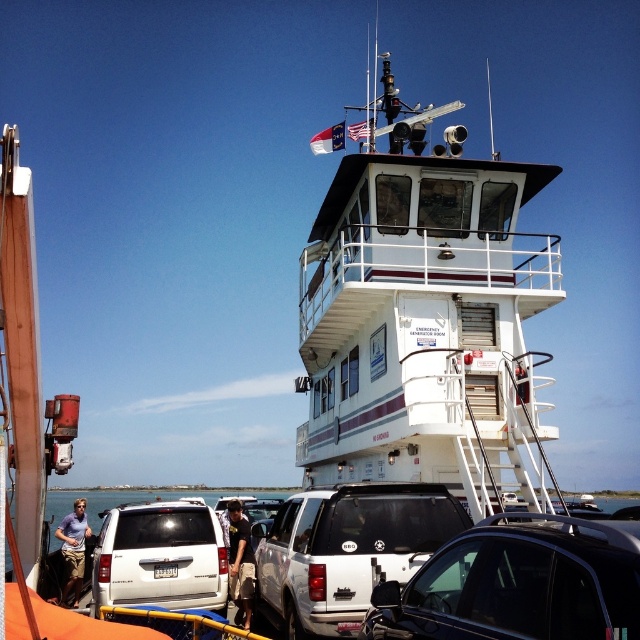
Question: Which object is positioned closest to the white matte suv at center?

Choices:
 (A) white glossy boat at upper center
 (B) white matte suv at lower left

Answer: (B)

Question: Can you confirm if white matte suv at center is thinner than matte blue shirt at lower left?

Choices:
 (A) yes
 (B) no

Answer: (A)

Question: Considering the real-world distances, which object is closest to the white matte suv at center?

Choices:
 (A) dark brown leather jacket at center
 (B) metallic silver suv at center
 (C) matte blue shirt at lower left

Answer: (B)

Question: Which point is closer to the camera taking this photo?

Choices:
 (A) (68, 572)
 (B) (428, 563)

Answer: (B)

Question: Does metallic silver suv at center have a smaller size compared to white matte suv at center?

Choices:
 (A) no
 (B) yes

Answer: (A)

Question: Considering the relative positions of white glossy boat at upper center and white matte suv at lower left in the image provided, where is white glossy boat at upper center located with respect to white matte suv at lower left?

Choices:
 (A) right
 (B) left

Answer: (A)